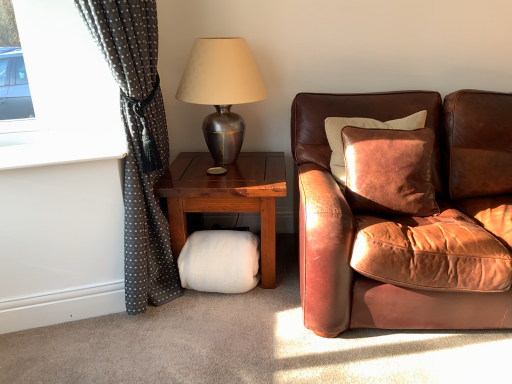
Where is `vacant space that's between dark grey polka dot fabric at left and white fluffy footrest at lower center`? The image size is (512, 384). vacant space that's between dark grey polka dot fabric at left and white fluffy footrest at lower center is located at coordinates (207, 317).